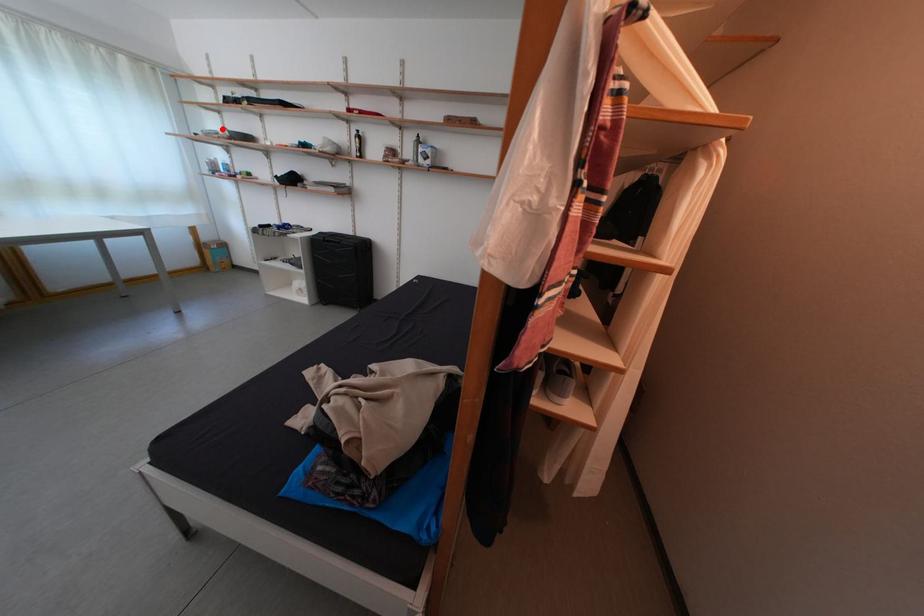
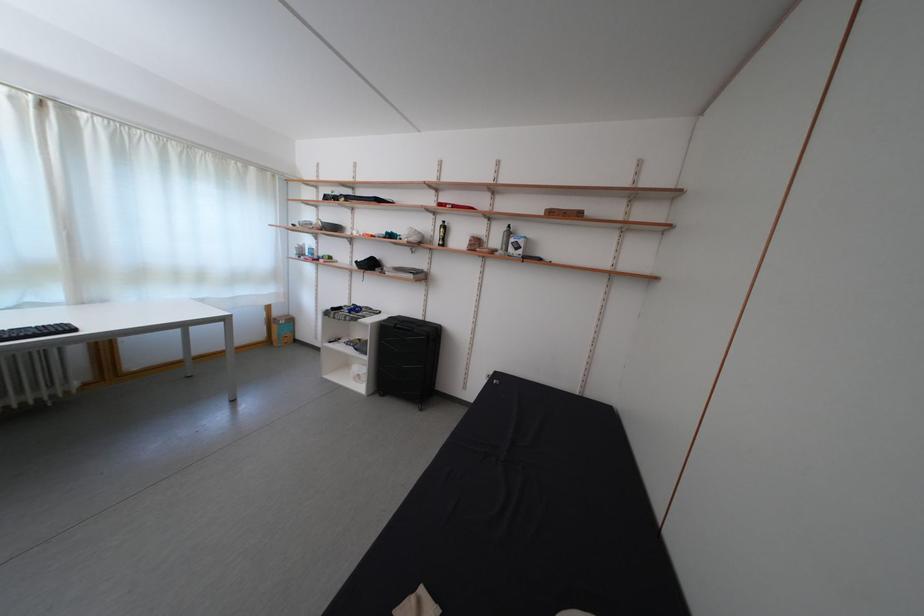
Where in the second image is the point corresponding to the highlighted location from the first image?

(319, 221)